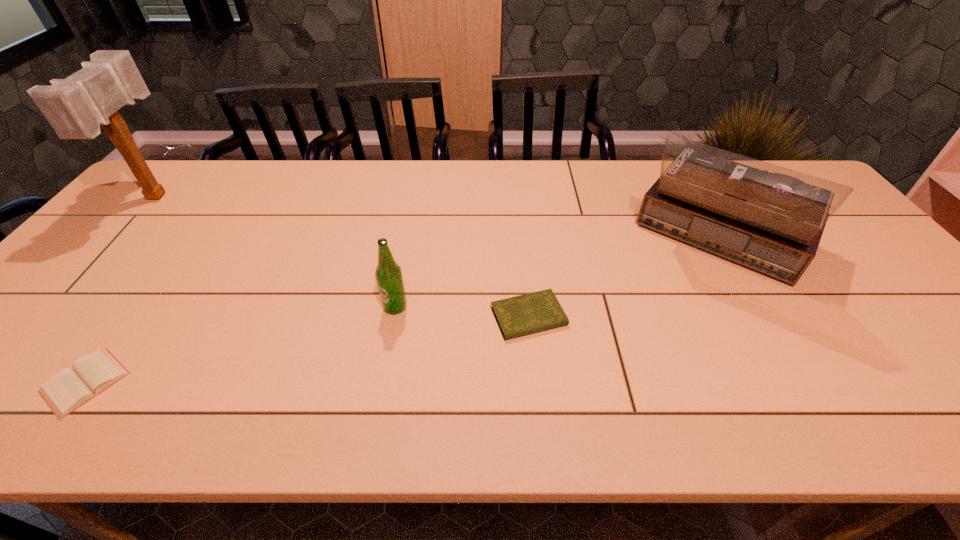
This screenshot has height=540, width=960. In order to click on the tallest object in this screenshot , I will do `click(75, 107)`.

Image resolution: width=960 pixels, height=540 pixels. Find the location of `mallet`. mallet is located at coordinates (75, 107).

This screenshot has height=540, width=960. Find the location of `record player`. record player is located at coordinates (769, 218).

Locate an element on the screen. Image resolution: width=960 pixels, height=540 pixels. the rightmost object is located at coordinates (769, 218).

Where is `the third object from right to left`? the third object from right to left is located at coordinates (388, 273).

What are the coordinates of `the third tallest object` in the screenshot? It's located at (388, 273).

Locate an element on the screen. Image resolution: width=960 pixels, height=540 pixels. the farther diary is located at coordinates (535, 312).

You are a GUI agent. You are given a task and a screenshot of the screen. Output one action in this format:
    pyautogui.click(x=<x>, y=<y>)
    Task: Click on the right diary
    
    Given the screenshot: What is the action you would take?
    pyautogui.click(x=535, y=312)

Identify the location of the nearest object. The height and width of the screenshot is (540, 960). (67, 390).

I want to click on the nearer diary, so click(67, 390).